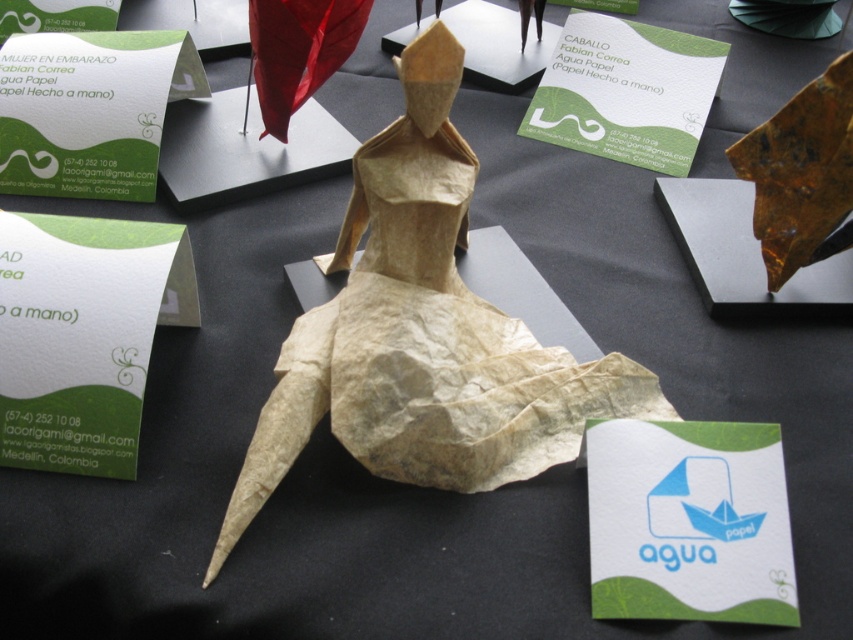
You are organizing an art exhibition and need to arrange the white paper boat at center and the green paper business card at upper left on a display table. The curator wants to know if the distance between them is sufficient to allow a 12 inch wide decorative mat to be placed between them without overlapping. Can you confirm this?

The white paper boat at center is 29.74 inches away from the green paper business card at upper left. Since the required space for the 12 inch wide decorative mat is less than the existing distance, the mat can be placed between them without overlapping.

You are standing 30 inches away from a table displaying origami art. You see a white paper boat at center. Can you reach it without moving your position?

The white paper boat at center is 25.94 inches away from the viewer, so yes, you can reach it since it is within your 30 inches distance range.

You are organizing an origami exhibition and need to place the white paper boat at center and green paper at upper center on a display stand. Which object requires a wider base to prevent tipping over?

The green paper at upper center requires a wider base because it has a greater width than the white paper boat at center, as stated in the description.